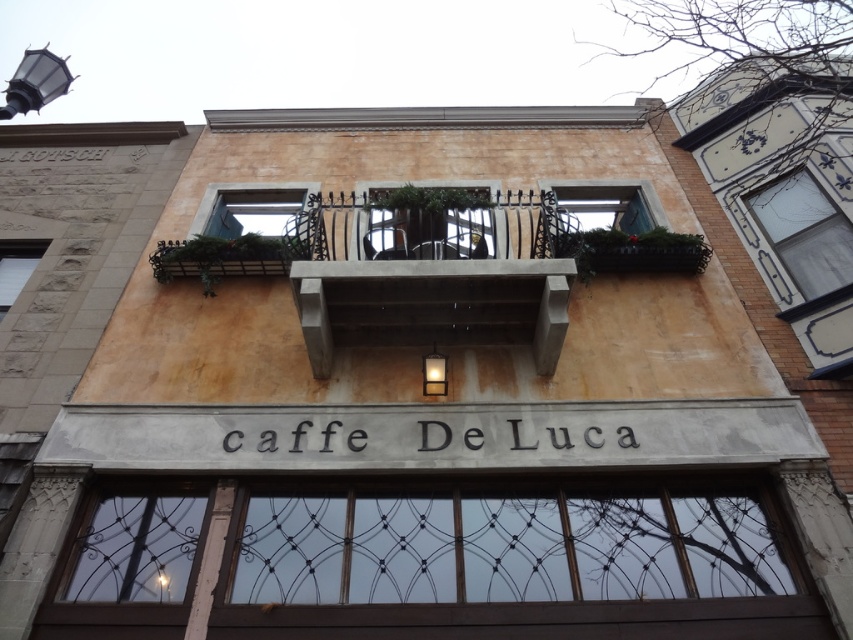
You are standing in front of the Caffe De Luca building. You see a brown wooden window at lower center and a concrete at center. Which object is located higher up on the building?

The concrete at center is located higher up on the building than the brown wooden window at lower center.

You are standing in front of the Caffe De Luca building and want to locate the brown wooden window at lower center. According to the building layout, where should you look relative to the concrete at center?

The brown wooden window at lower center is positioned on the right side of concrete at center.